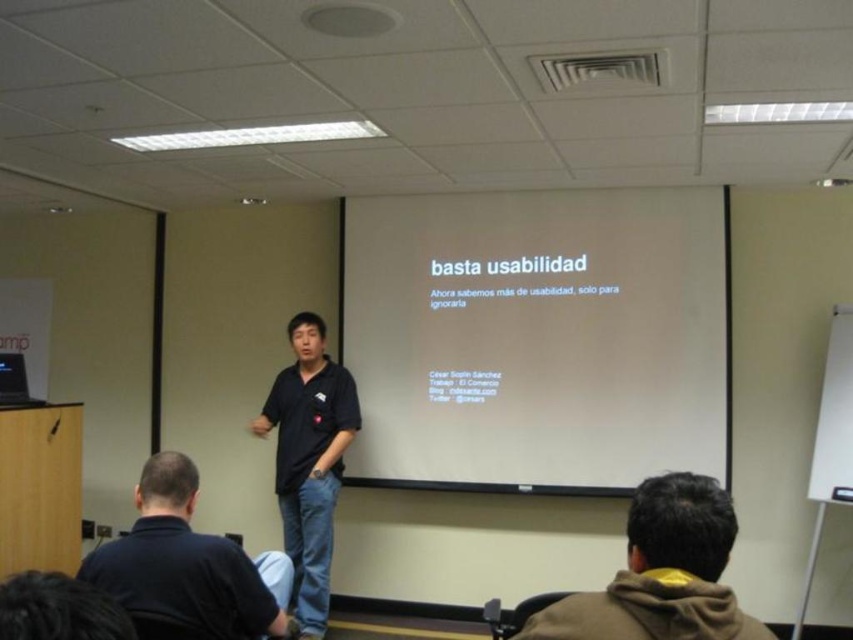
Is white matte projection screen at center above black matte shirt at center?

Yes.

Does white matte projection screen at center lie in front of black matte shirt at center?

No, white matte projection screen at center is behind black matte shirt at center.

Who is more distant from viewer, (724, 397) or (314, 602)?

The point (724, 397) is more distant.

Where is `white matte projection screen at center`? This screenshot has width=853, height=640. white matte projection screen at center is located at coordinates (537, 337).

Is brown fleece jacket at lower right wider than black matte shirt at center?

In fact, brown fleece jacket at lower right might be narrower than black matte shirt at center.

Does brown fleece jacket at lower right have a greater height compared to black matte shirt at center?

No, brown fleece jacket at lower right is not taller than black matte shirt at center.

Does point (665, 516) come closer to viewer compared to point (305, 317)?

Yes, point (665, 516) is in front of point (305, 317).

This screenshot has width=853, height=640. In order to click on brown fleece jacket at lower right in this screenshot , I will do `click(660, 573)`.

Is white matte projection screen at center behind dark blue shirt at lower left?

Yes, white matte projection screen at center is behind dark blue shirt at lower left.

Does white matte projection screen at center appear on the left side of dark blue shirt at lower left?

Incorrect, white matte projection screen at center is not on the left side of dark blue shirt at lower left.

Does point (454, 317) come farther from viewer compared to point (204, 627)?

Yes.

This screenshot has width=853, height=640. What are the coordinates of `white matte projection screen at center` in the screenshot? It's located at (537, 337).